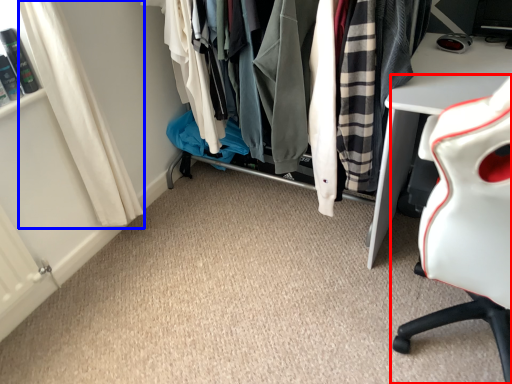
Question: Among these objects, which one is farthest to the camera, chair (highlighted by a red box) or curtain (highlighted by a blue box)?

Choices:
 (A) chair
 (B) curtain

Answer: (B)